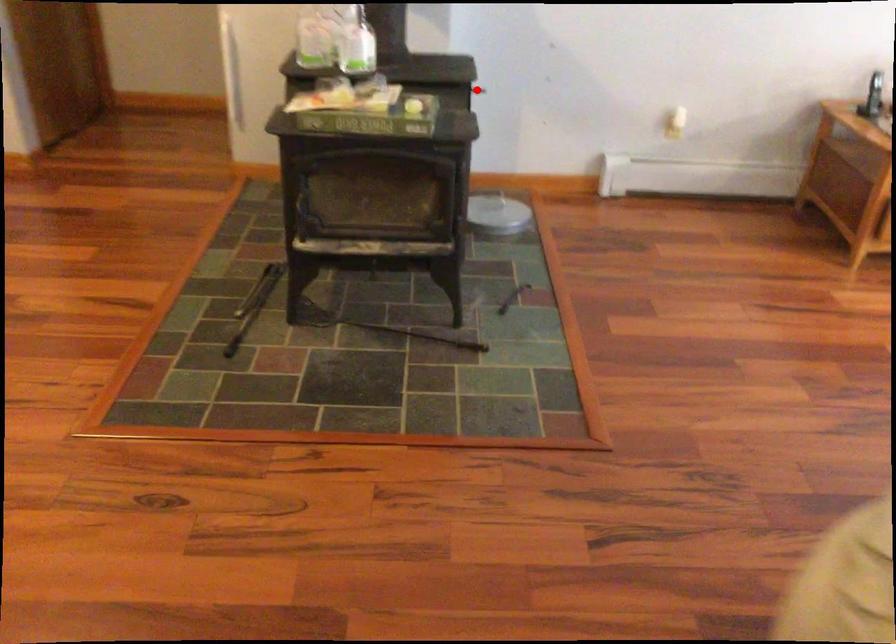
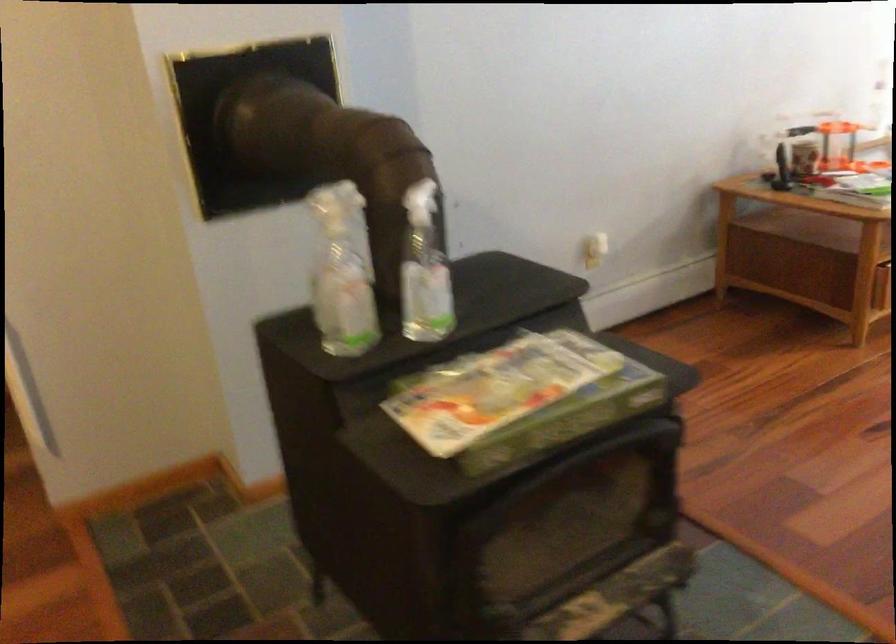
Question: I am providing you with two images of the same scene from different viewpoints. A red point is marked on the first image. At the location where the point appears in image 1, is it still visible in image 2?

Choices:
 (A) Yes
 (B) No

Answer: (B)